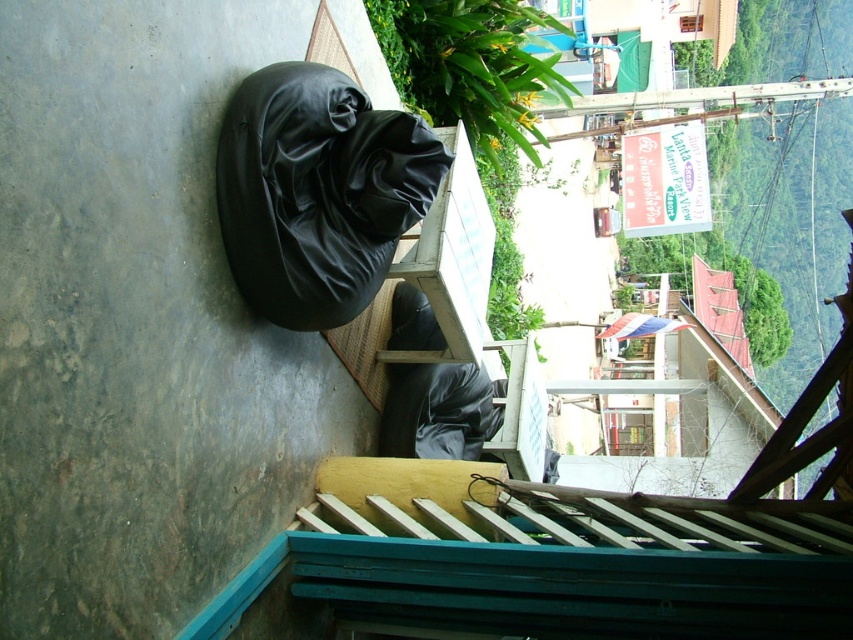
A customer wants to place a 2.5 meter long ladder between the black leather beanbag at upper left and the wooden table with rattan base at lower right. Is there enough space for the ladder to fit horizontally between them?

The distance between the black leather beanbag at upper left and the wooden table with rattan base at lower right is 3.58 meters. Since the ladder is 2.5 meters long, there is enough space to place it horizontally between them as the distance is greater than the ladder length.

You are planning to place a large potted plant between the black leather beanbag at upper left and the matte black beanbag at center. Based on their widths, can you determine if there will be enough space for the plant?

The black leather beanbag at upper left might be wider than matte black beanbag at center, so there may not be enough space for the plant between them.

You are a delivery person carrying a package that requires a 7 feet wide space to place. You see the black leather beanbag at upper left and the matte black beanbag at center. Can you place the package between them?

The distance between the black leather beanbag at upper left and the matte black beanbag at center is 6.84 feet, which is less than 7 feet. Therefore, the package cannot be placed between them as there isn not enough space.